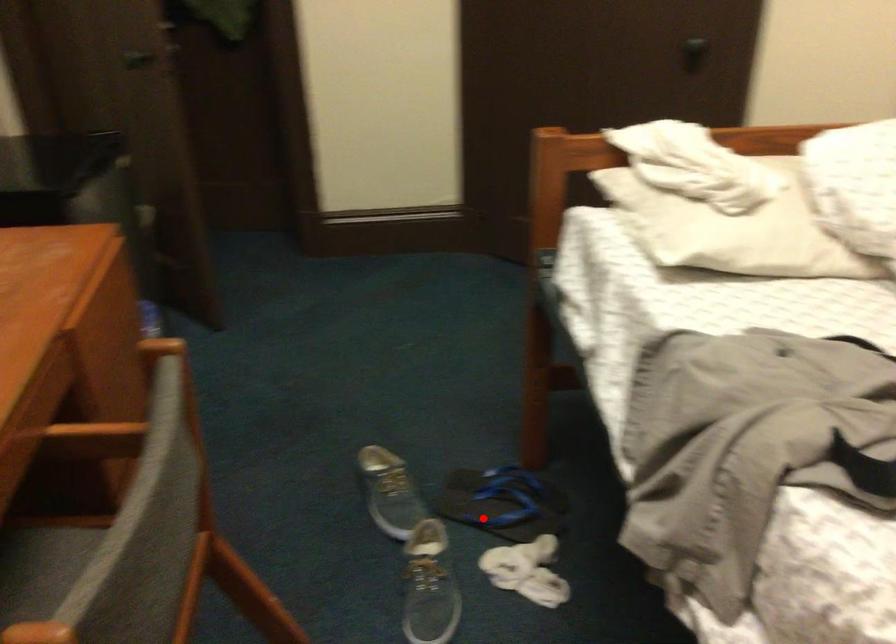
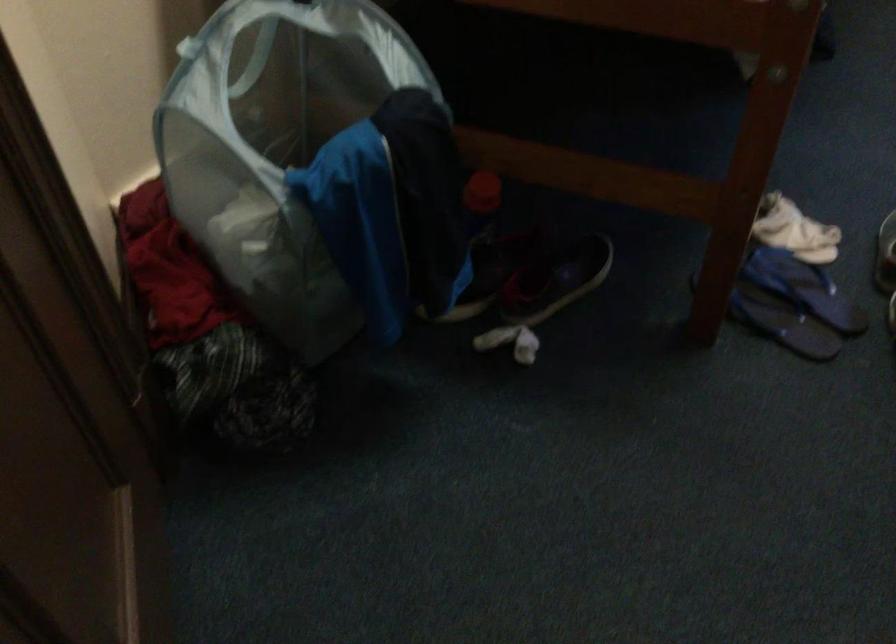
Question: I am providing you with two images of the same scene from different viewpoints. Image1 has a red point marked. In image2, the corresponding 3D location appears at what relative position? Reply with the corresponding letter.

Choices:
 (A) Closer
 (B) Farther

Answer: (A)